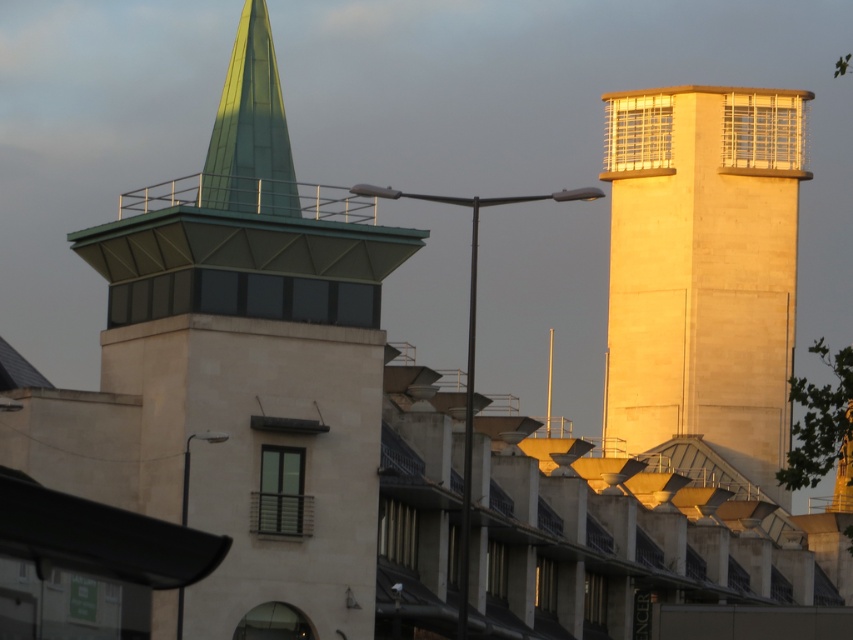
Question: Where is beige stone tower at right located in relation to green glass spire at upper left in the image?

Choices:
 (A) right
 (B) left

Answer: (A)

Question: Based on their relative distances, which object is farther from the green stone tower at upper left?

Choices:
 (A) green glass spire at upper left
 (B) beige stone tower at right

Answer: (B)

Question: Considering the real-world distances, which object is farthest from the green stone tower at upper left?

Choices:
 (A) green glass spire at upper left
 (B) beige stone tower at right

Answer: (B)

Question: Which of the following is the farthest from the observer?

Choices:
 (A) beige stone tower at right
 (B) green glass spire at upper left

Answer: (A)

Question: Is green stone tower at upper left wider than beige stone tower at right?

Choices:
 (A) no
 (B) yes

Answer: (A)

Question: Where is beige stone tower at right located in relation to green glass spire at upper left in the image?

Choices:
 (A) left
 (B) right

Answer: (B)